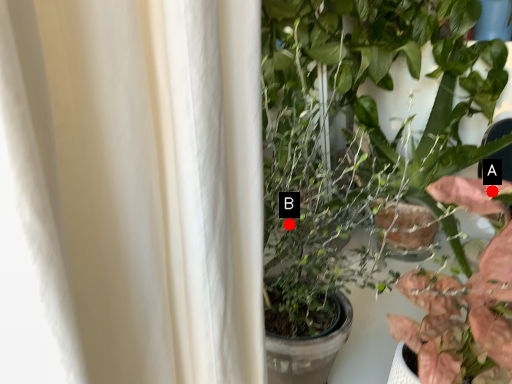
Question: Two points are circled on the image, labeled by A and B beside each circle. Which point appears farthest from the camera in this image?

Choices:
 (A) A is further
 (B) B is further

Answer: (B)